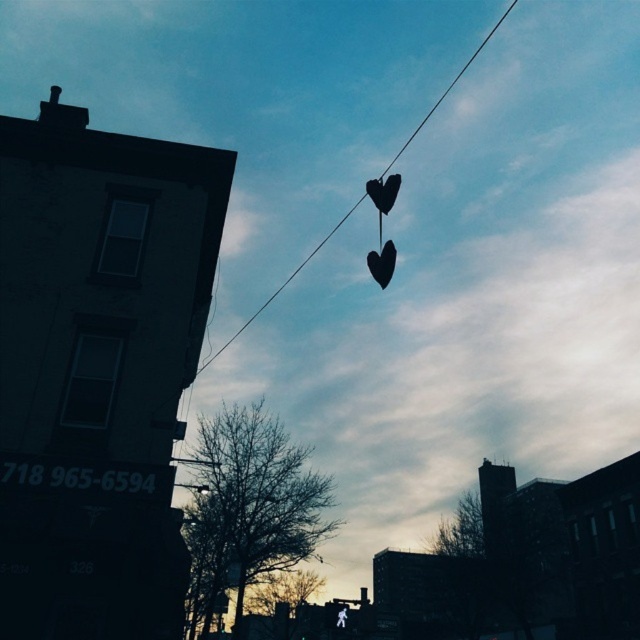
Is black matte heart at center wider than black matte heart at upper center?

Correct, the width of black matte heart at center exceeds that of black matte heart at upper center.

Locate an element on the screen. The image size is (640, 640). black matte heart at center is located at coordinates (381, 262).